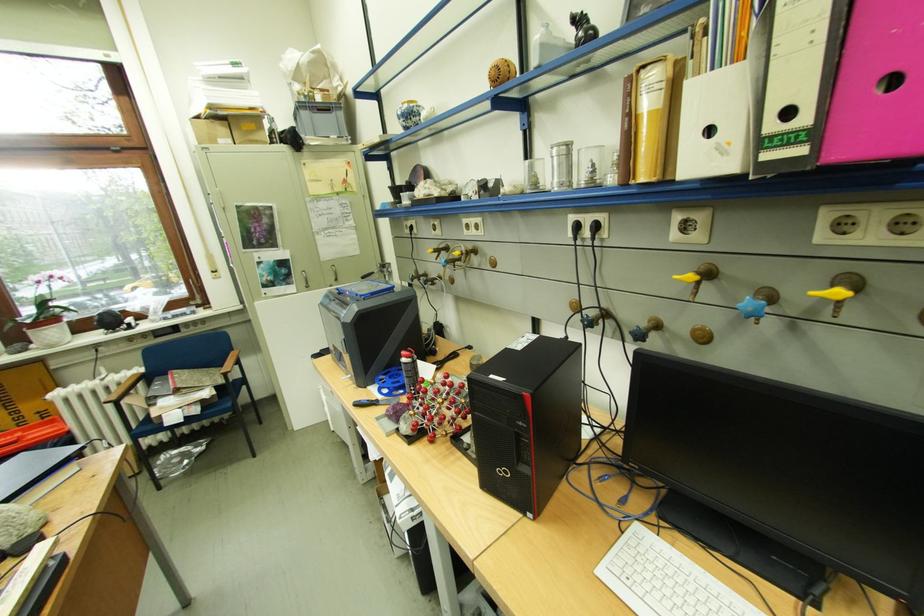
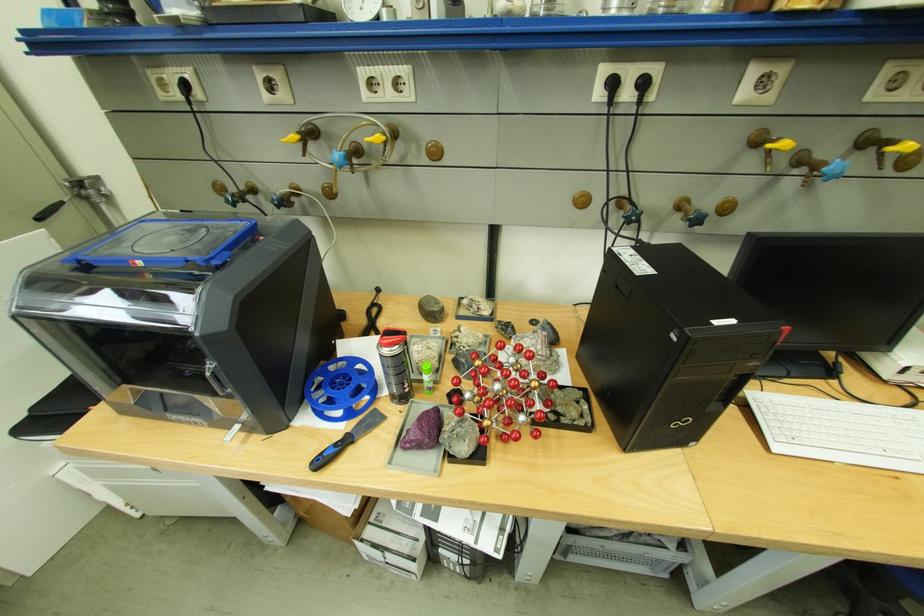
The images are taken continuously from a first-person perspective. In which direction is your viewpoint rotating?

The camera rotated toward right-down.